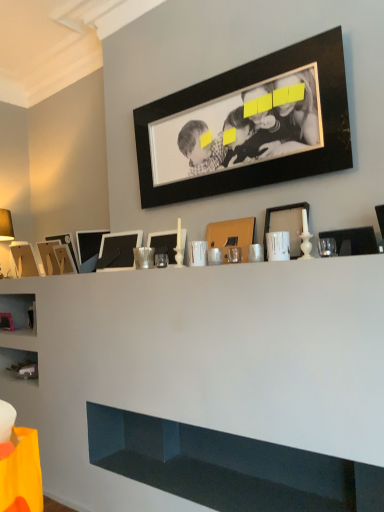
Question: Visually, is matte brown picture frame at center, the 3th picture frame viewed from the right, positioned to the left or to the right of white glossy cabinet at lower center?

Choices:
 (A) right
 (B) left

Answer: (A)

Question: Which is correct: matte brown picture frame at center, marked as the eighth picture frame in a left-to-right arrangement, is inside white glossy cabinet at lower center, or outside of it?

Choices:
 (A) inside
 (B) outside

Answer: (B)

Question: Estimate the real-world distances between objects in this image. Which object is farther from the matte black picture frame at left, placed as the seventh picture frame when sorted from right to left?

Choices:
 (A) matte black picture frame at left, which is the third picture frame from left to right
 (B) matte gold table lamp at left
 (C) matte black picture frame at right, marked as the tenth picture frame in a left-to-right arrangement
 (D) black matte picture frame at center, which is the 6th picture frame in right-to-left order
 (E) wooden picture frame at left, positioned as the 2th picture frame in left-to-right order

Answer: (C)

Question: Estimate the real-world distances between objects in this image. Which object is closer to the white glossy cabinet at lower center?

Choices:
 (A) black matte picture frame at center, the 5th picture frame in the left-to-right sequence
 (B) matte black picture frame at right, marked as the tenth picture frame in a left-to-right arrangement
 (C) white glossy picture frame at center, the 6th picture frame viewed from the left
 (D) matte cardboard picture frame at left, marked as the tenth picture frame in a right-to-left arrangement
 (E) matte gold table lamp at left

Answer: (A)